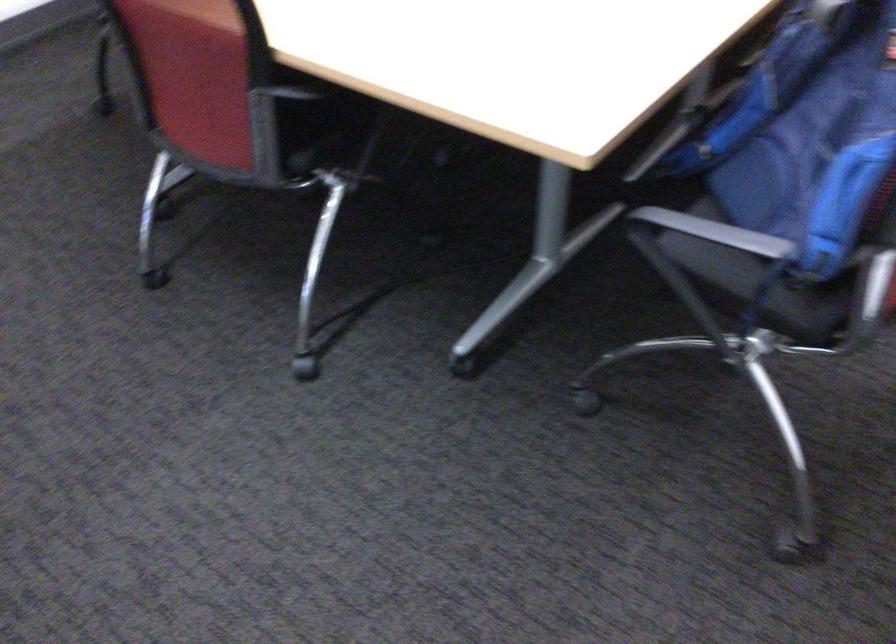
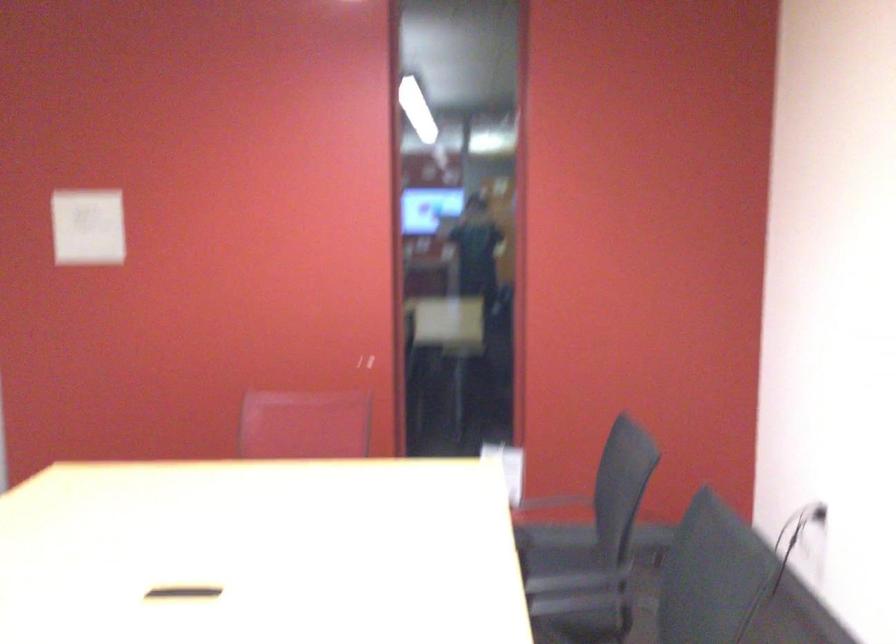
The first image is from the beginning of the video and the second image is from the end. How did the camera likely rotate when shooting the video?

The camera's rotation is toward right-up.